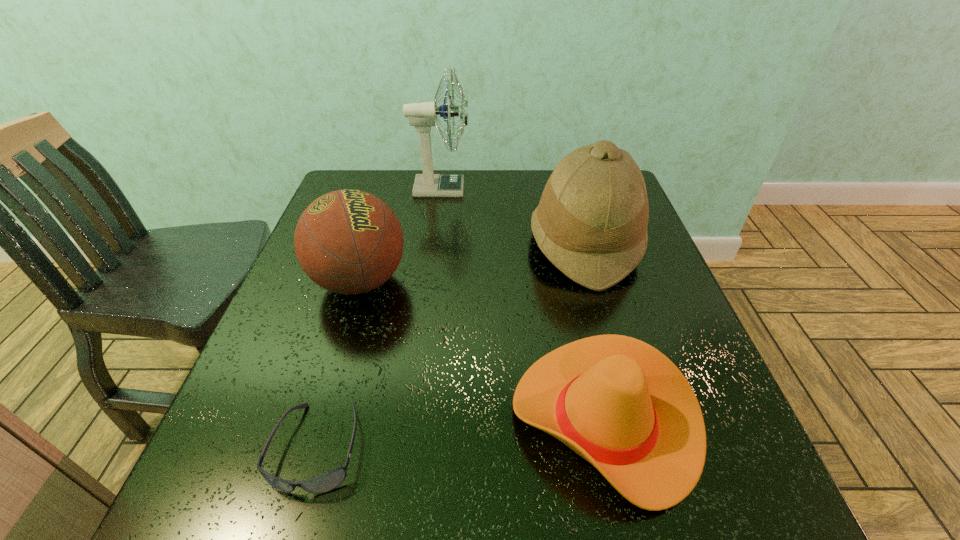
The height and width of the screenshot is (540, 960). In order to click on free spot located 0.360m on the back of the cowboy hat in this screenshot , I will do `click(564, 238)`.

The height and width of the screenshot is (540, 960). Identify the location of fan present at the far edge. (422, 115).

The height and width of the screenshot is (540, 960). Identify the location of hat positioned at the far edge. (591, 223).

This screenshot has width=960, height=540. I want to click on cowboy hat that is positioned at the near edge, so click(x=619, y=403).

What are the coordinates of `sunglasses at the near edge` in the screenshot? It's located at (326, 482).

The width and height of the screenshot is (960, 540). Find the location of `basketball present at the left edge`. basketball present at the left edge is located at coordinates (347, 241).

Locate an element on the screen. sunglasses that is at the left edge is located at coordinates (326, 482).

What are the coordinates of `hat present at the right edge` in the screenshot? It's located at (591, 223).

The image size is (960, 540). Find the location of `cowboy hat that is positioned at the right edge`. cowboy hat that is positioned at the right edge is located at coordinates (619, 403).

This screenshot has height=540, width=960. I want to click on object that is at the near left corner, so click(x=326, y=482).